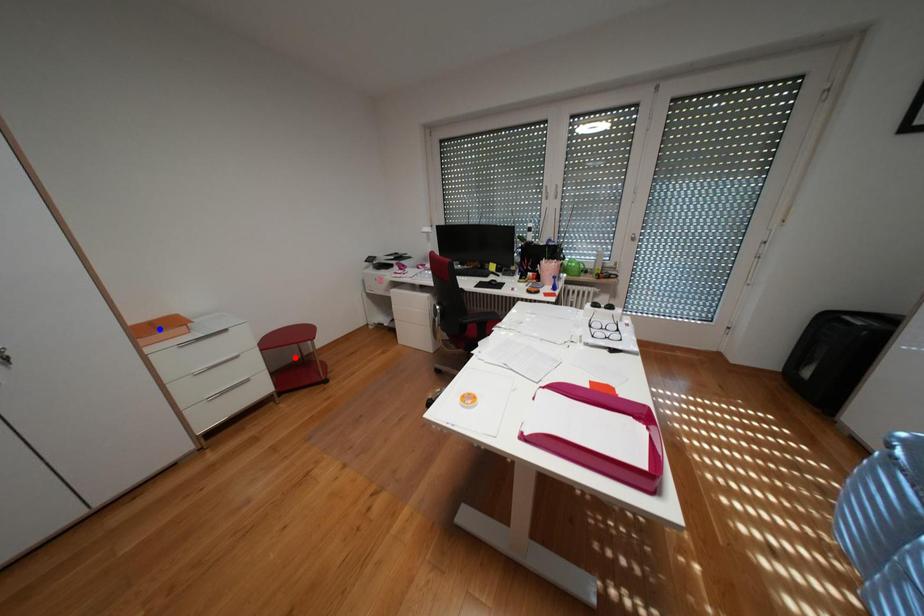
Question: Two points are marked on the image. Which point is closer to the camera?

Choices:
 (A) Blue point is closer.
 (B) Red point is closer.

Answer: (A)